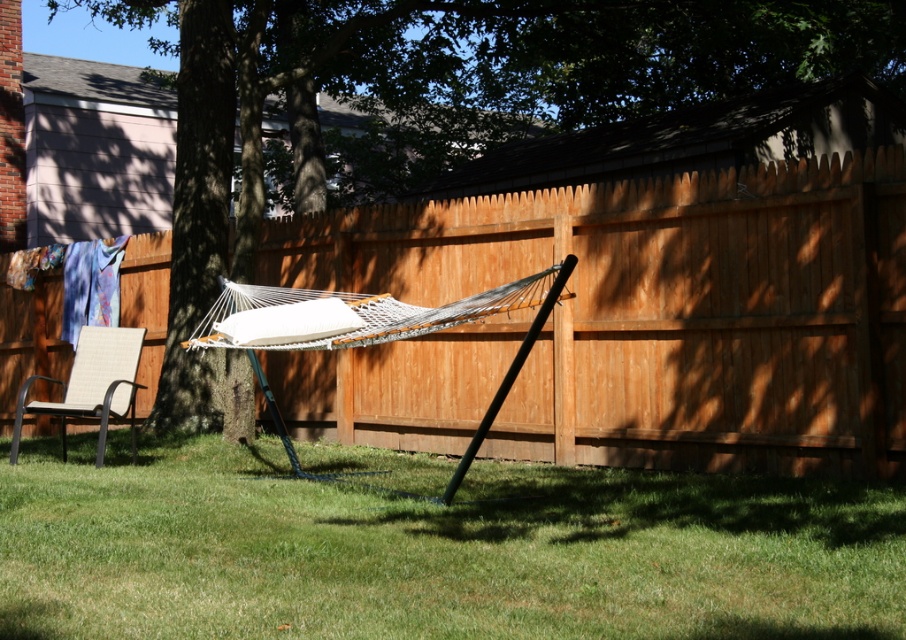
Does green grass at center have a greater width compared to brown wood tree at center?

No, green grass at center is not wider than brown wood tree at center.

How much distance is there between green grass at center and brown wood tree at center?

They are 19.37 meters apart.

Locate an element on the screen. The width and height of the screenshot is (906, 640). green grass at center is located at coordinates (432, 550).

In order to click on green grass at center in this screenshot , I will do `click(432, 550)`.

Who is taller, brown wood tree at center or beige woven chair at lower left?

Standing taller between the two is brown wood tree at center.

Is brown wood tree at center shorter than beige woven chair at lower left?

No, brown wood tree at center is not shorter than beige woven chair at lower left.

Who is more forward, (387, 42) or (105, 349)?

Positioned in front is point (105, 349).

Where is `brown wood tree at center`? brown wood tree at center is located at coordinates (485, 81).

Who is more forward, (89, 618) or (85, 348)?

Positioned in front is point (89, 618).

Who is taller, green grass at center or beige woven chair at lower left?

Standing taller between the two is beige woven chair at lower left.

Describe the element at coordinates (432, 550) in the screenshot. I see `green grass at center` at that location.

At what (x,y) coordinates should I click in order to perform the action: click on green grass at center. Please return your answer as a coordinate pair (x, y). Looking at the image, I should click on pos(432,550).